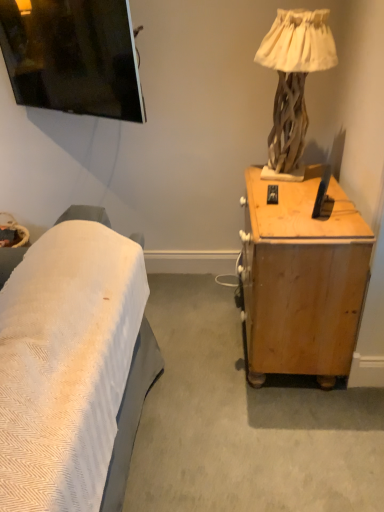
Question: From the image's perspective, is wooden textured lamp at upper right located above or below wooden desk at right?

Choices:
 (A) above
 (B) below

Answer: (A)

Question: Is wooden textured lamp at upper right taller or shorter than wooden desk at right?

Choices:
 (A) tall
 (B) short

Answer: (B)

Question: Looking at their shapes, would you say wooden textured lamp at upper right is wider or thinner than wooden desk at right?

Choices:
 (A) thin
 (B) wide

Answer: (A)

Question: Do you think wooden desk at right is within wooden textured lamp at upper right, or outside of it?

Choices:
 (A) inside
 (B) outside

Answer: (B)

Question: In the image, is wooden desk at right positioned in front of or behind wooden textured lamp at upper right?

Choices:
 (A) front
 (B) behind

Answer: (A)

Question: Looking at the image, does wooden desk at right seem bigger or smaller compared to wooden textured lamp at upper right?

Choices:
 (A) big
 (B) small

Answer: (A)

Question: From a real-world perspective, is wooden desk at right above or below wooden textured lamp at upper right?

Choices:
 (A) above
 (B) below

Answer: (B)